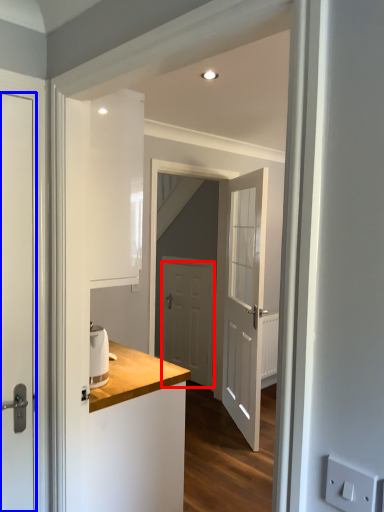
Question: Which of the following is the closest to the observer, door (highlighted by a red box) or door (highlighted by a blue box)?

Choices:
 (A) door
 (B) door

Answer: (B)